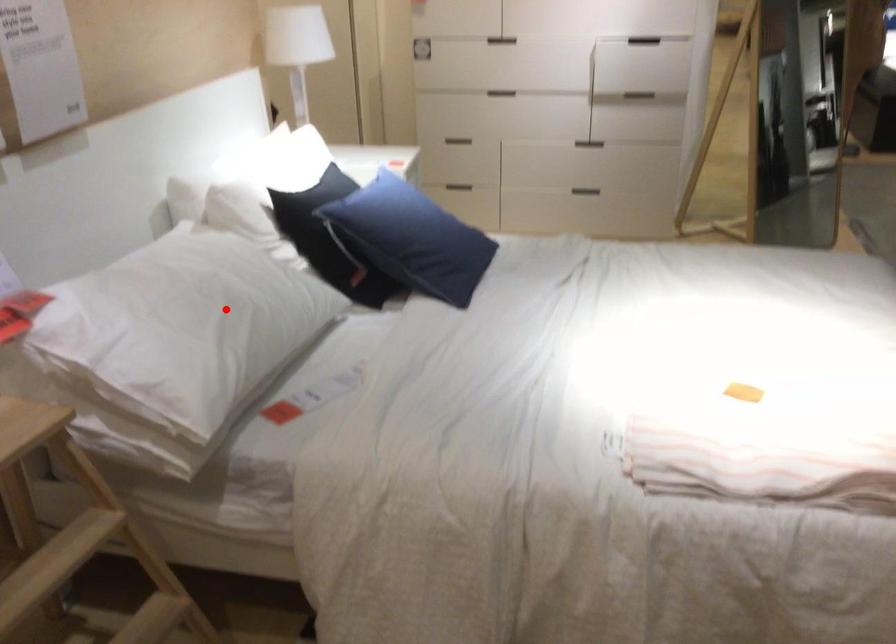
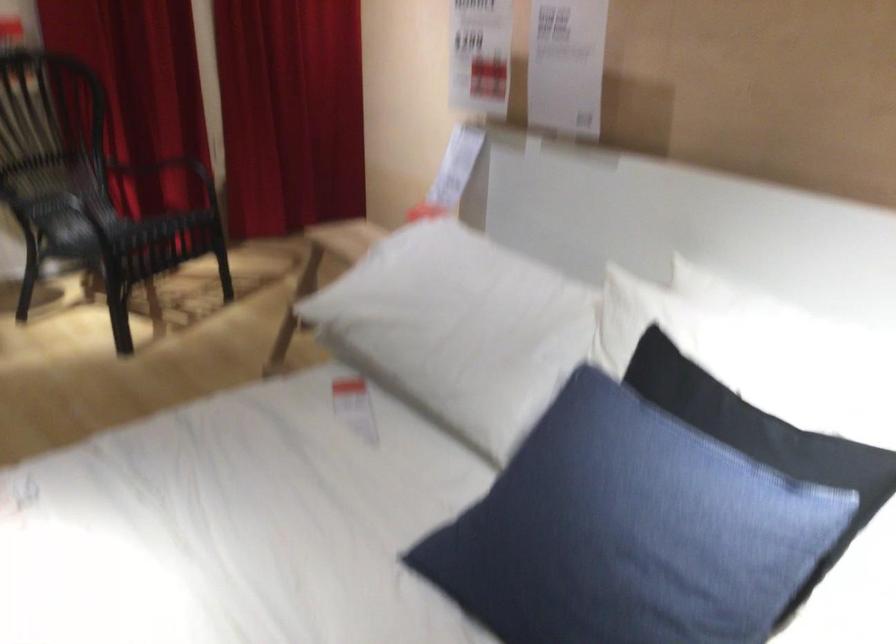
Where in the second image is the point corresponding to the highlighted location from the first image?

(455, 321)